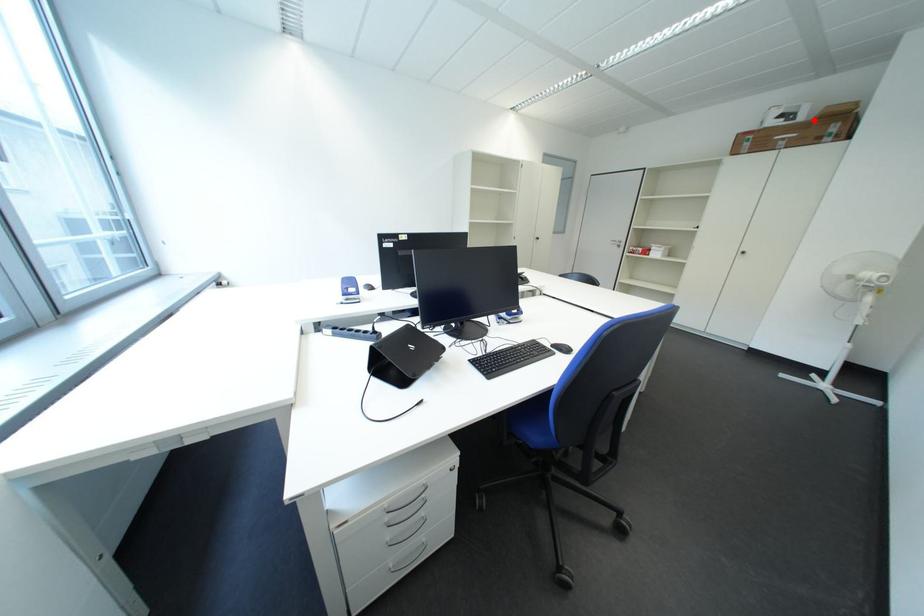
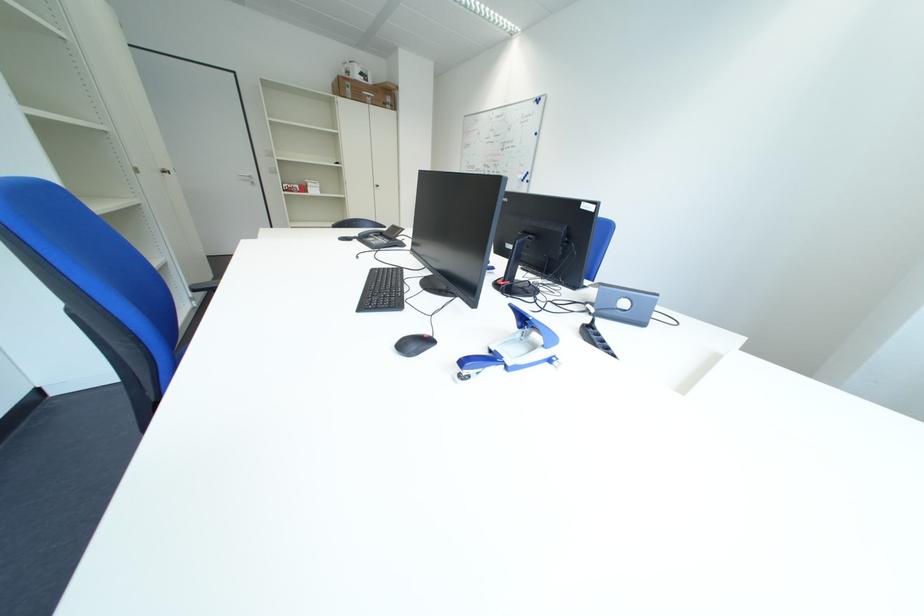
Question: I am providing you with two images of the same scene from different viewpoints. Given a red point in image1, look at the same physical point in image2. Is it:

Choices:
 (A) Closer to the viewpoint
 (B) Farther from the viewpoint

Answer: (A)